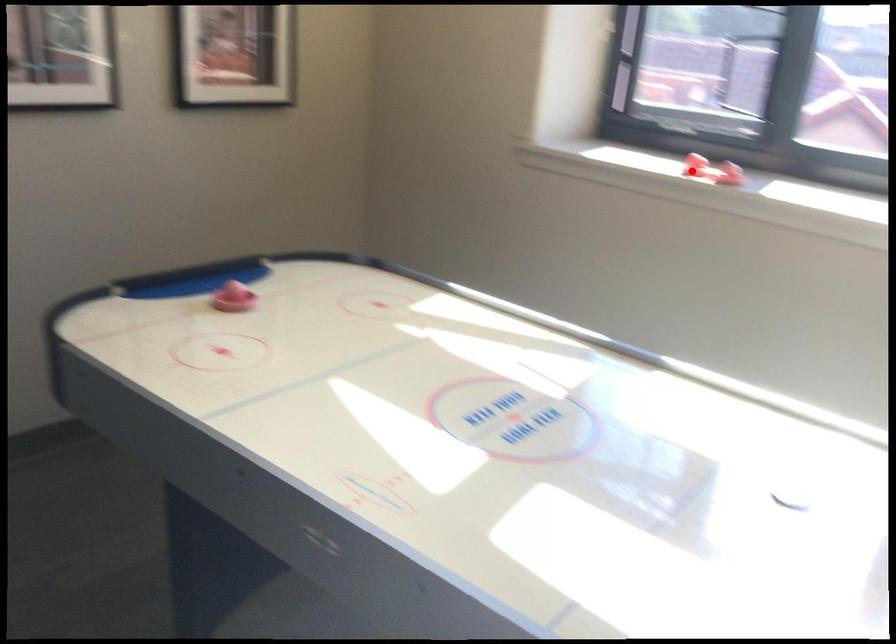
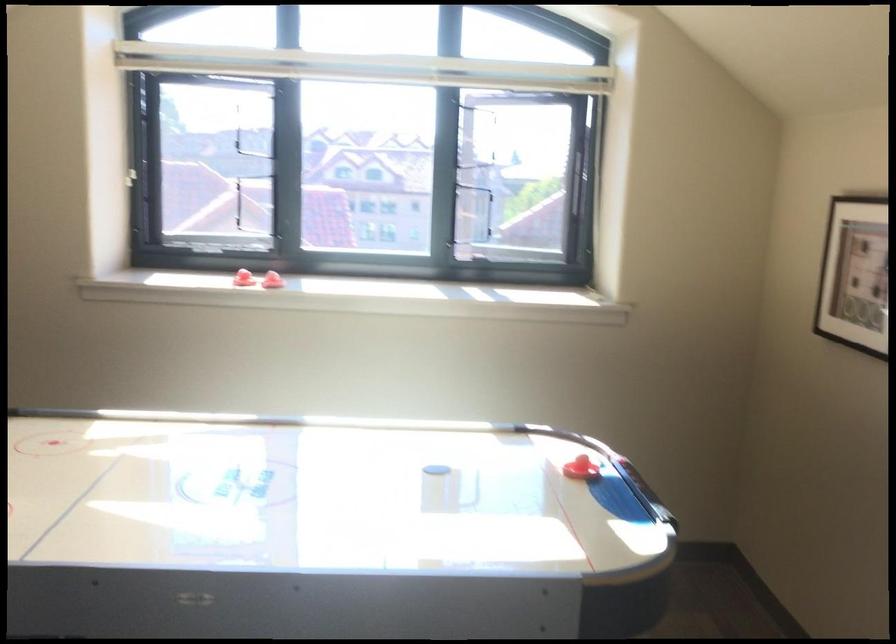
Question: I am providing you with two images of the same scene from different viewpoints. In image1, a red point is highlighted. Considering the same 3D point in image2, which of the following is correct?

Choices:
 (A) It is closer
 (B) It is farther

Answer: (B)